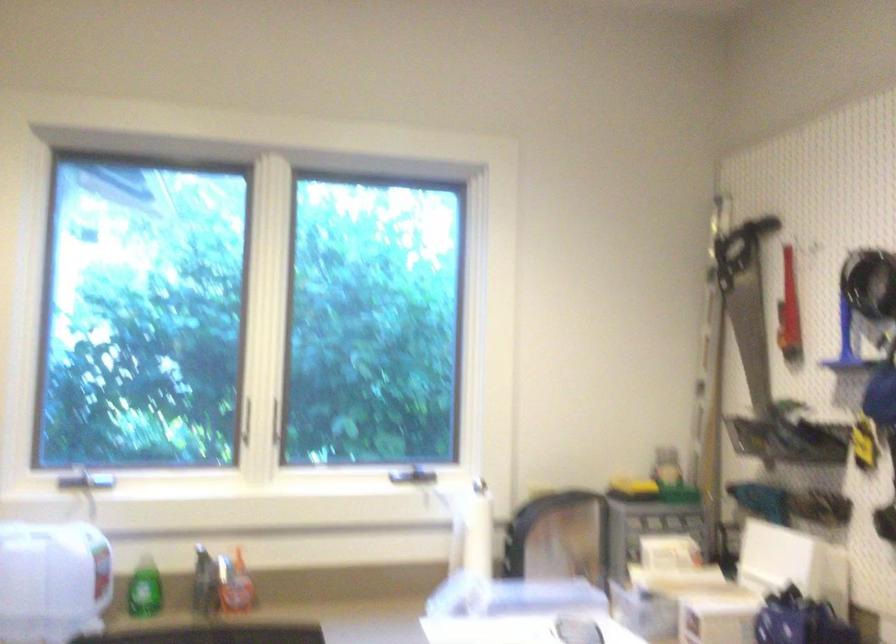
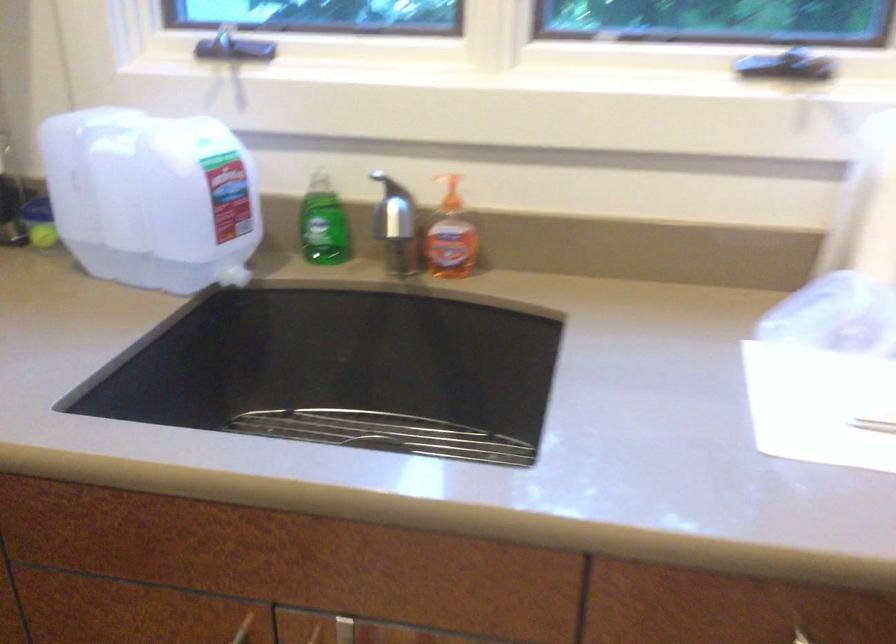
Find the pixel in the second image that matches (x=95, y=529) in the first image.

(220, 135)